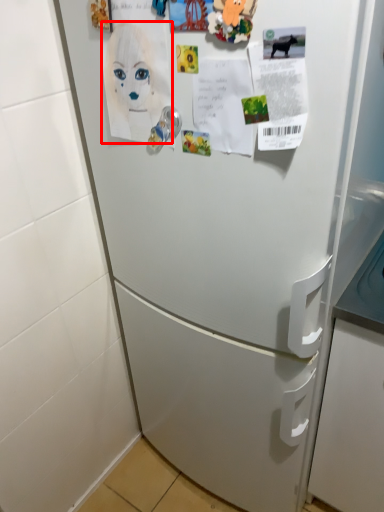
Question: Observing the image, what is the correct spatial positioning of woman (annotated by the red box) in reference to door handle?

Choices:
 (A) right
 (B) left

Answer: (B)